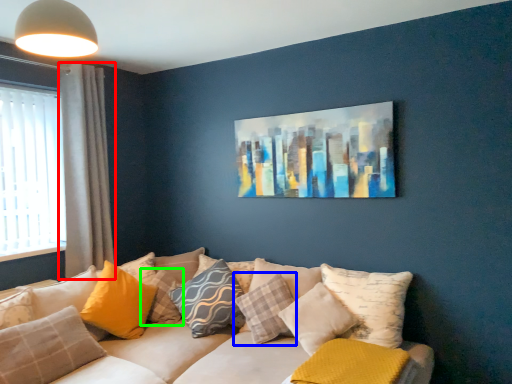
Question: Considering the real-world distances, which object is closest to curtain (highlighted by a red box)? pillow (highlighted by a blue box) or pillow (highlighted by a green box).

Choices:
 (A) pillow
 (B) pillow

Answer: (B)